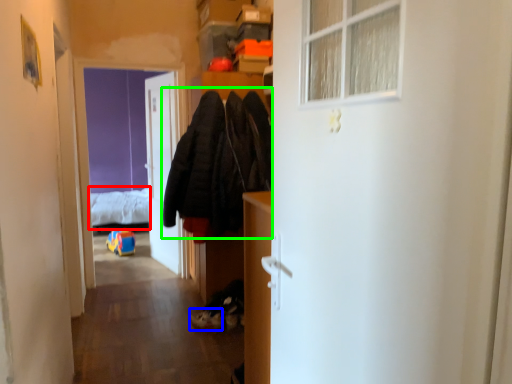
Question: Considering the real-world distances, which object is farthest from bed (highlighted by a red box)? shoe (highlighted by a blue box) or clothing (highlighted by a green box)?

Choices:
 (A) shoe
 (B) clothing

Answer: (A)